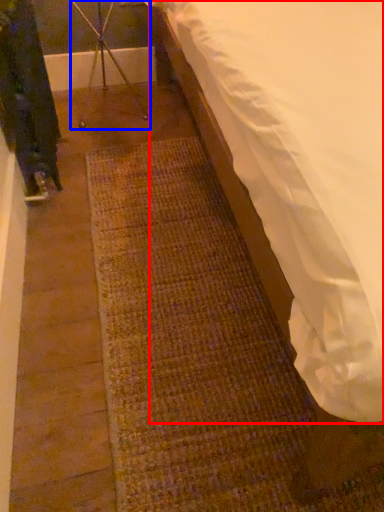
Question: Which of the following is the farthest to the observer, mattress (highlighted by a red box) or tripod (highlighted by a blue box)?

Choices:
 (A) mattress
 (B) tripod

Answer: (B)